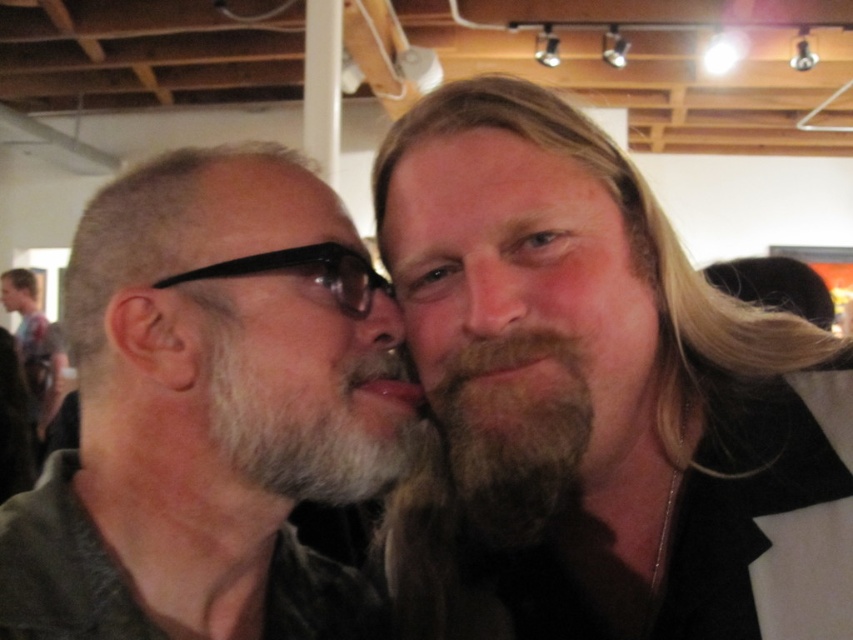
Question: Which point is farther to the camera?

Choices:
 (A) (x=509, y=516)
 (B) (x=625, y=428)
 (C) (x=352, y=307)
 (D) (x=155, y=580)

Answer: (B)

Question: Is black plastic glasses at center thinner than smooth skin nose at center?

Choices:
 (A) yes
 (B) no

Answer: (B)

Question: Which of the following is the farthest from the observer?

Choices:
 (A) (117, 250)
 (B) (483, 524)
 (C) (762, 416)

Answer: (C)

Question: Is gray matte beard at left thinner than white fuzzy beard at center?

Choices:
 (A) yes
 (B) no

Answer: (B)

Question: Is brown matte nose at center below black plastic glasses at center?

Choices:
 (A) yes
 (B) no

Answer: (B)

Question: Which point is farther to the camera?

Choices:
 (A) (426, 182)
 (B) (312, 273)

Answer: (A)